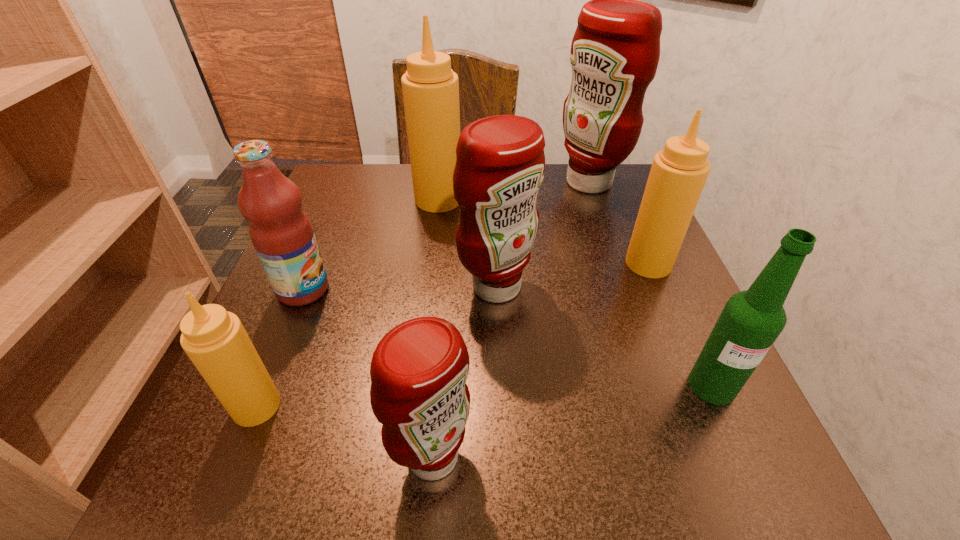
The image size is (960, 540). Find the location of `the smallest tan condiment`. the smallest tan condiment is located at coordinates (214, 339).

Where is `the nearest red condiment`? This screenshot has width=960, height=540. the nearest red condiment is located at coordinates (419, 369).

I want to click on vacant space located on the left of the rightmost red condiment, so click(444, 183).

Locate an element on the screen. Image resolution: width=960 pixels, height=540 pixels. free space located 0.050m on the left of the farthest tan condiment is located at coordinates (393, 199).

Where is `free space located on the back of the second smallest tan condiment`? free space located on the back of the second smallest tan condiment is located at coordinates (618, 192).

This screenshot has height=540, width=960. What are the coordinates of `vacant region located on the back of the second biggest red condiment` in the screenshot? It's located at (494, 233).

This screenshot has height=540, width=960. Find the location of `blank space located on the front label of the fruit juice`. blank space located on the front label of the fruit juice is located at coordinates (363, 289).

At what (x,y) coordinates should I click in order to perform the action: click on vacant space located 0.130m on the label of the green beer bottle. Please return your answer as a coordinate pair (x, y). Looking at the image, I should click on (764, 503).

Locate an element on the screen. blank space located on the back of the smallest tan condiment is located at coordinates (312, 272).

This screenshot has height=540, width=960. Identify the location of free space located 0.240m on the left of the nearest red condiment. (210, 456).